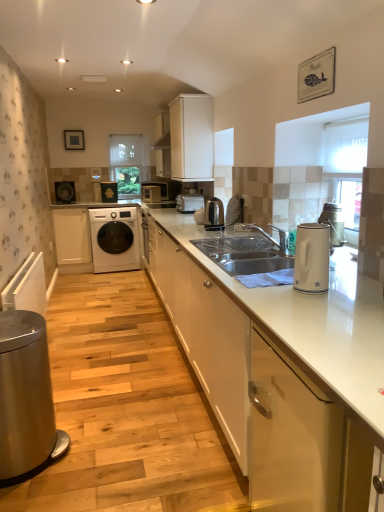
Question: Does white textured blinds at upper right, positioned as the 1th window screen in front-to-back order, have a smaller size compared to white glossy washing machine at center?

Choices:
 (A) yes
 (B) no

Answer: (A)

Question: Does white textured blinds at upper right, which is the 2th window screen from left to right, have a greater height compared to white glossy washing machine at center?

Choices:
 (A) no
 (B) yes

Answer: (A)

Question: From the image's perspective, is white textured blinds at upper right, which is the 2th window screen from top to bottom, under white glossy washing machine at center?

Choices:
 (A) no
 (B) yes

Answer: (A)

Question: Is white textured blinds at upper right, which is the 2th window screen from left to right, positioned behind white glossy washing machine at center?

Choices:
 (A) no
 (B) yes

Answer: (A)

Question: From the image's perspective, does white textured blinds at upper right, positioned as the 1th window screen in front-to-back order, appear higher than white glossy washing machine at center?

Choices:
 (A) yes
 (B) no

Answer: (A)

Question: Is white textured blinds at upper right, marked as the 1th window screen in a right-to-left arrangement, in front of white glossy washing machine at center?

Choices:
 (A) no
 (B) yes

Answer: (B)

Question: Does matte black washing machine at left, positioned as the 3th appliance in back-to-front order, lie in front of white textured blinds at upper right, positioned as the 1th window screen in front-to-back order?

Choices:
 (A) yes
 (B) no

Answer: (B)

Question: Is matte black washing machine at left, the second appliance from the front, oriented towards white textured blinds at upper right, which is the 2th window screen from top to bottom?

Choices:
 (A) no
 (B) yes

Answer: (B)

Question: Is matte black washing machine at left, the second appliance from the front, taller than white textured blinds at upper right, positioned as the 2th window screen in back-to-front order?

Choices:
 (A) yes
 (B) no

Answer: (B)

Question: Is matte black washing machine at left, the second appliance from the front, outside of white textured blinds at upper right, the 1th window screen ordered from the bottom?

Choices:
 (A) no
 (B) yes

Answer: (B)

Question: From the image's perspective, is matte black washing machine at left, placed as the first appliance when sorted from left to right, located above white textured blinds at upper right, marked as the 1th window screen in a right-to-left arrangement?

Choices:
 (A) no
 (B) yes

Answer: (B)

Question: Can you confirm if matte black washing machine at left, placed as the first appliance when sorted from left to right, is bigger than white textured blinds at upper right, marked as the 1th window screen in a right-to-left arrangement?

Choices:
 (A) no
 (B) yes

Answer: (B)

Question: Does white glossy electric kettle at right, marked as the 4th home appliance in a back-to-front arrangement, have a lesser height compared to white glossy microwave at center, arranged as the fourth appliance when viewed from the front?

Choices:
 (A) no
 (B) yes

Answer: (B)